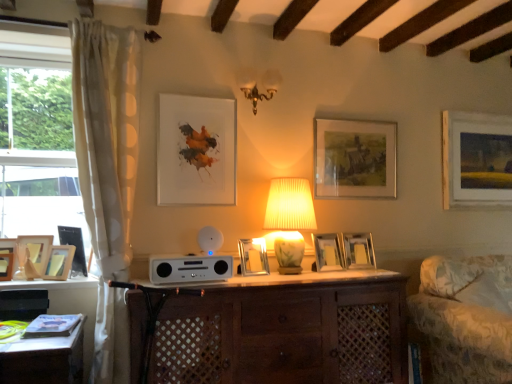
The width and height of the screenshot is (512, 384). I want to click on free location above wooden picture frame at upper right, placed as the first picture frame when sorted from right to left (from a real-world perspective), so click(x=476, y=113).